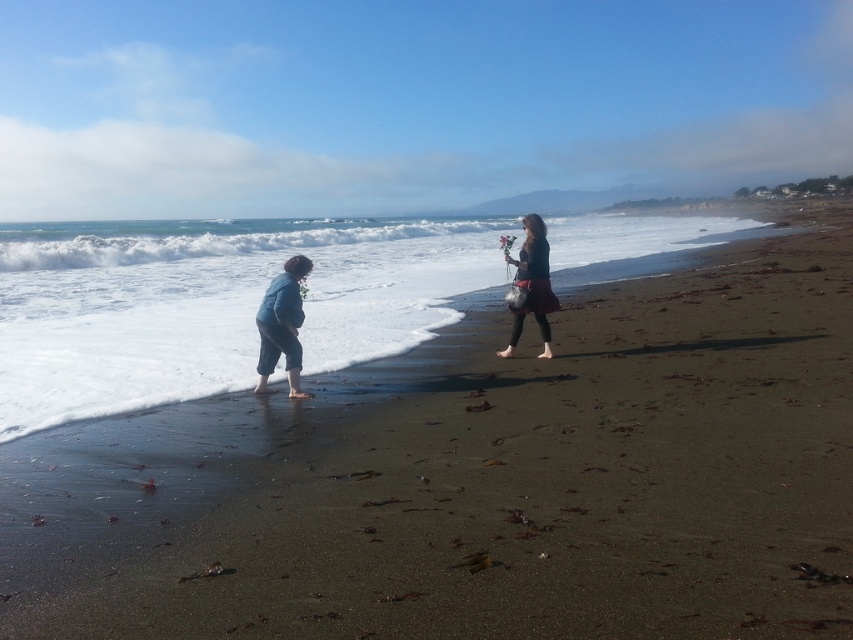
Question: Is dark brown sand at lower left positioned behind dark blue fabric dress at center right?

Choices:
 (A) yes
 (B) no

Answer: (B)

Question: Can you confirm if dark brown sand at lower left is bigger than dark blue fabric dress at center right?

Choices:
 (A) yes
 (B) no

Answer: (A)

Question: Is dark brown sand at lower left thinner than denim pants at left?

Choices:
 (A) no
 (B) yes

Answer: (A)

Question: Which point appears farthest from the camera in this image?

Choices:
 (A) (523, 218)
 (B) (265, 337)
 (C) (781, 544)

Answer: (A)

Question: Among these points, which one is nearest to the camera?

Choices:
 (A) (514, 477)
 (B) (308, 266)

Answer: (A)

Question: Among these points, which one is nearest to the camera?

Choices:
 (A) (527, 264)
 (B) (271, 339)
 (C) (339, 602)

Answer: (C)